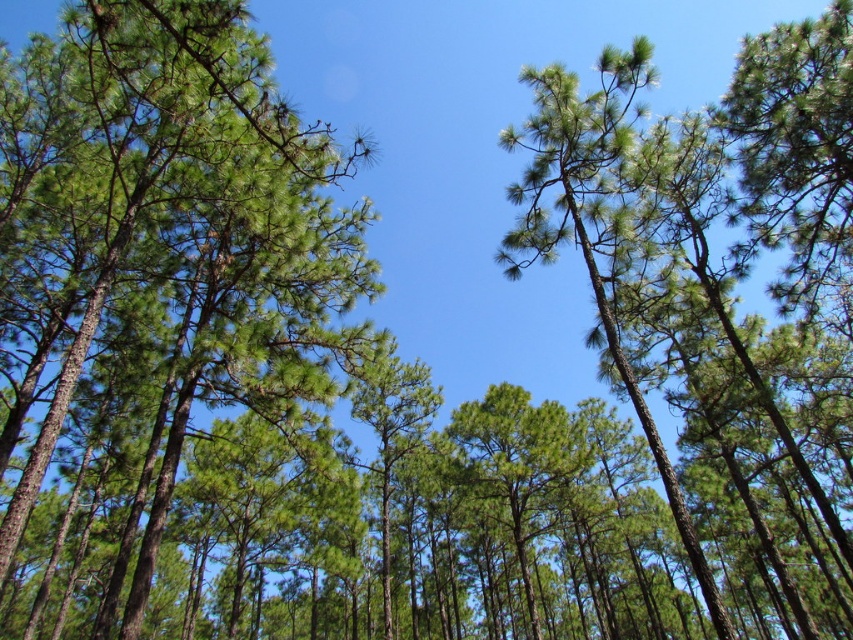
Question: Can you confirm if green needle-like at center is positioned above green needle-like at upper center?

Choices:
 (A) no
 (B) yes

Answer: (A)

Question: Is green needle-like at center positioned before green needle-like at upper center?

Choices:
 (A) no
 (B) yes

Answer: (B)

Question: Is green needle-like at center above green needle-like at upper center?

Choices:
 (A) no
 (B) yes

Answer: (A)